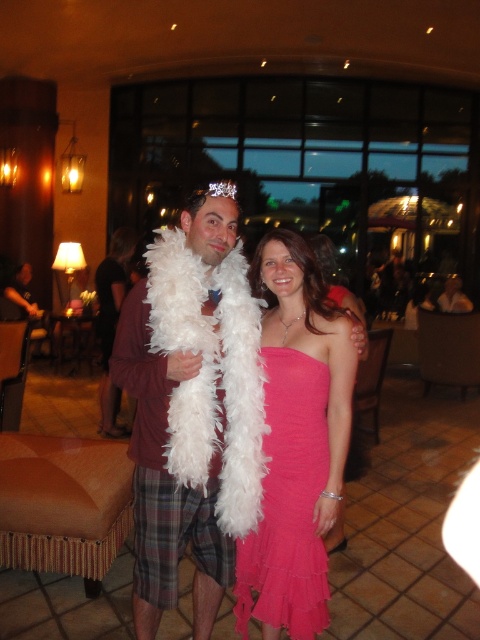
Is white feather boa at center to the right of pink satin dress at center from the viewer's perspective?

In fact, white feather boa at center is to the left of pink satin dress at center.

Describe the element at coordinates (191, 410) in the screenshot. The image size is (480, 640). I see `white feather boa at center` at that location.

Where is `white feather boa at center`? This screenshot has width=480, height=640. white feather boa at center is located at coordinates (191, 410).

Is pink satin dress at center shorter than clear crystal tiara at upper center?

Yes, pink satin dress at center is shorter than clear crystal tiara at upper center.

Measure the distance between pink satin dress at center and camera.

pink satin dress at center is 6.16 feet away from camera.

At what (x,y) coordinates should I click in order to perform the action: click on pink satin dress at center. Please return your answer as a coordinate pair (x, y). Looking at the image, I should click on (288, 502).

Which is above, white feather boa at center or clear crystal tiara at upper center?

Positioned higher is clear crystal tiara at upper center.

Is white feather boa at center further to the viewer compared to clear crystal tiara at upper center?

No, white feather boa at center is in front of clear crystal tiara at upper center.

Does point (168, 266) come in front of point (231, 192)?

Yes.

Where is `white feather boa at center`? white feather boa at center is located at coordinates (191, 410).